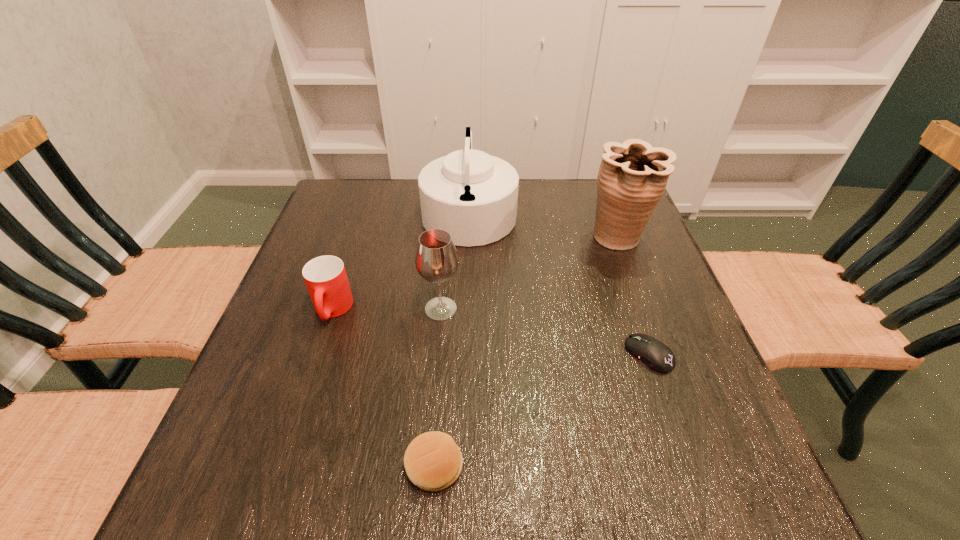
Identify the location of kettle. This screenshot has height=540, width=960. (472, 195).

I want to click on urn, so click(x=632, y=178).

I want to click on wineglass, so click(436, 260).

I want to click on the third shortest object, so click(325, 276).

Find the location of a particular element. This screenshot has width=960, height=540. cup is located at coordinates (325, 276).

Locate an element on the screen. the second shortest object is located at coordinates (433, 462).

Locate an element on the screen. This screenshot has height=540, width=960. patty is located at coordinates [433, 462].

Locate an element on the screen. The height and width of the screenshot is (540, 960). the fifth farthest object is located at coordinates coord(656,355).

Where is `computer equipment`? The height and width of the screenshot is (540, 960). computer equipment is located at coordinates (656, 355).

Find the location of a particular element. free space located on the spout of the kettle is located at coordinates (602, 211).